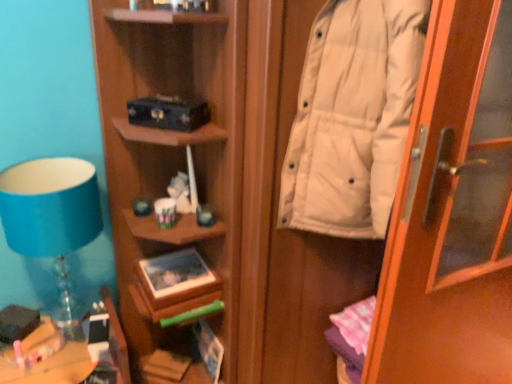
Measure the distance between wooden desk at lower left and camera.

wooden desk at lower left is 1.27 meters from camera.

What is the approximate height of matte green book at center, the 2th book from the top?

The height of matte green book at center, the 2th book from the top, is 4.74 inches.

What do you see at coordinates (209, 348) in the screenshot? I see `matte blue book at lower center, marked as the second book in a bottom-to-top arrangement` at bounding box center [209, 348].

Describe the element at coordinates (168, 113) in the screenshot. Image resolution: width=512 pixels, height=384 pixels. I see `matte black book at upper center, which is counted as the fourth book, starting from the bottom` at that location.

Locate an element on the screen. The image size is (512, 384). white matte door at right is located at coordinates (452, 212).

Locate an element on the screen. The width and height of the screenshot is (512, 384). wooden desk at lower left is located at coordinates (51, 367).

Does wooden desk at lower left have a lesser width compared to white matte door at right?

Incorrect, the width of wooden desk at lower left is not less than that of white matte door at right.

In the image, is wooden desk at lower left on the left side or the right side of white matte door at right?

wooden desk at lower left is to the left of white matte door at right.

Is wooden desk at lower left inside or outside of white matte door at right?

wooden desk at lower left is outside white matte door at right.

Does wooden desk at lower left have a greater width compared to matte green book at center, the 3th book in the bottom-to-top sequence?

Yes, wooden desk at lower left is wider than matte green book at center, the 3th book in the bottom-to-top sequence.

Is wooden desk at lower left far away from matte green book at center, the 2th book from the top?

No, there isn't a large distance between wooden desk at lower left and matte green book at center, the 2th book from the top.

From the image's perspective, which book is the 2nd one above the wooden desk at lower left? Please provide its 2D coordinates.

[(176, 273)]

How many degrees apart are the facing directions of wooden desk at lower left and matte green book at center, the 2th book from the top?

0.0574 degrees.

From a real-world perspective, is white matte coat at right on matte black book at upper center, which is counted as the fourth book, starting from the bottom?

Correct, in the physical world, white matte coat at right is higher than matte black book at upper center, which is counted as the fourth book, starting from the bottom.

Who is taller, white matte coat at right or matte black book at upper center, the 1th book in the top-to-bottom sequence?

white matte coat at right.

In terms of size, does white matte coat at right appear bigger or smaller than matte black book at upper center, the 1th book in the top-to-bottom sequence?

Considering their sizes, white matte coat at right takes up more space than matte black book at upper center, the 1th book in the top-to-bottom sequence.

Can matte green book at center, the 2th book from the top, be found inside matte blue book at lower center, the 3th book from the top?

No, matte green book at center, the 2th book from the top, is not a part of matte blue book at lower center, the 3th book from the top.

Would you say matte blue book at lower center, the 3th book from the top, is to the left or to the right of matte green book at center, the 2th book from the top, in the picture?

From the image, it's evident that matte blue book at lower center, the 3th book from the top, is to the right of matte green book at center, the 2th book from the top.

Is matte blue book at lower center, marked as the second book in a bottom-to-top arrangement, taller than matte green book at center, the 3th book in the bottom-to-top sequence?

Indeed, matte blue book at lower center, marked as the second book in a bottom-to-top arrangement, has a greater height compared to matte green book at center, the 3th book in the bottom-to-top sequence.

Is matte blue glass at left oriented away from matte blue book at lower center, the 3th book from the top?

matte blue glass at left does not have its back to matte blue book at lower center, the 3th book from the top.

Considering the relative positions of matte blue glass at left and matte blue book at lower center, the 3th book from the top, in the image provided, is matte blue glass at left in front of matte blue book at lower center, the 3th book from the top,?

Yes.

How distant is matte blue glass at left from matte blue book at lower center, the 3th book from the top?

matte blue glass at left is 69.18 centimeters away from matte blue book at lower center, the 3th book from the top.

Locate an element on the screen. This screenshot has height=384, width=512. table lamp above the matte blue book at lower center, marked as the second book in a bottom-to-top arrangement (from a real-world perspective) is located at coordinates (51, 212).

Considering the positions of objects matte green book at center, the 3th book in the bottom-to-top sequence, and matte blue book at lower center, marked as the second book in a bottom-to-top arrangement, in the image provided, who is more to the left, matte green book at center, the 3th book in the bottom-to-top sequence, or matte blue book at lower center, marked as the second book in a bottom-to-top arrangement,?

matte green book at center, the 3th book in the bottom-to-top sequence.

Do you think matte green book at center, the 3th book in the bottom-to-top sequence, is within matte blue book at lower center, marked as the second book in a bottom-to-top arrangement, or outside of it?

matte green book at center, the 3th book in the bottom-to-top sequence, is located beyond the bounds of matte blue book at lower center, marked as the second book in a bottom-to-top arrangement.

Is point (175, 255) closer to viewer compared to point (209, 343)?

Yes.

Can you confirm if matte green book at center, the 2th book from the top, is shorter than matte blue book at lower center, the 3th book from the top?

Yes, matte green book at center, the 2th book from the top, is shorter than matte blue book at lower center, the 3th book from the top.

Which of these two, matte blue book at lower center, marked as the second book in a bottom-to-top arrangement, or hardcover book at lower center, acting as the 4th book starting from the top, is thinner?

matte blue book at lower center, marked as the second book in a bottom-to-top arrangement.

Is matte blue book at lower center, the 3th book from the top, facing towards hardcover book at lower center, the first book positioned from the bottom?

Yes, matte blue book at lower center, the 3th book from the top, is facing hardcover book at lower center, the first book positioned from the bottom.

Is matte blue book at lower center, marked as the second book in a bottom-to-top arrangement, positioned in front of hardcover book at lower center, the first book positioned from the bottom?

Yes, the depth of matte blue book at lower center, marked as the second book in a bottom-to-top arrangement, is less than that of hardcover book at lower center, the first book positioned from the bottom.

Find the location of `door on the right of wooden desk at lower left`. door on the right of wooden desk at lower left is located at coordinates (452, 212).

In the image, there is a matte green book at center, the 2th book from the top. Identify the location of furniture below it (from the image's perspective). This screenshot has height=384, width=512. (51, 367).

Estimate the real-world distances between objects in this image. Which object is further from matte green book at center, the 2th book from the top, white matte coat at right or matte black book at upper center, which is counted as the fourth book, starting from the bottom?

white matte coat at right is positioned further to the anchor matte green book at center, the 2th book from the top.

Based on their spatial positions, is white matte door at right or matte blue book at lower center, marked as the second book in a bottom-to-top arrangement, closer to hardcover book at lower center, acting as the 4th book starting from the top?

matte blue book at lower center, marked as the second book in a bottom-to-top arrangement, is closer to hardcover book at lower center, acting as the 4th book starting from the top.

From the image, which object appears to be nearer to matte blue book at lower center, the 3th book from the top, white matte coat at right or hardcover book at lower center, the first book positioned from the bottom?

hardcover book at lower center, the first book positioned from the bottom, is closer to matte blue book at lower center, the 3th book from the top.

From the image, which object appears to be nearer to wooden desk at lower left, matte black book at upper center, the 1th book in the top-to-bottom sequence, or white matte door at right?

matte black book at upper center, the 1th book in the top-to-bottom sequence, is closer to wooden desk at lower left.

From the image, which object appears to be nearer to hardcover book at lower center, the first book positioned from the bottom, white matte coat at right or matte black book at upper center, which is counted as the fourth book, starting from the bottom?

matte black book at upper center, which is counted as the fourth book, starting from the bottom, is positioned closer to the anchor hardcover book at lower center, the first book positioned from the bottom.

Based on their spatial positions, is hardcover book at lower center, acting as the 4th book starting from the top, or white matte coat at right closer to matte black book at upper center, the 1th book in the top-to-bottom sequence?

Among the two, white matte coat at right is located nearer to matte black book at upper center, the 1th book in the top-to-bottom sequence.

Based on their spatial positions, is white matte door at right or matte black book at upper center, which is counted as the fourth book, starting from the bottom, further from hardcover book at lower center, the first book positioned from the bottom?

The object further to hardcover book at lower center, the first book positioned from the bottom, is white matte door at right.

Which object lies nearer to the anchor point wooden desk at lower left, matte green book at center, the 3th book in the bottom-to-top sequence, or matte black book at upper center, the 1th book in the top-to-bottom sequence?

matte green book at center, the 3th book in the bottom-to-top sequence, is positioned closer to the anchor wooden desk at lower left.

Locate an element on the screen. coat located between matte green book at center, the 3th book in the bottom-to-top sequence, and white matte door at right in the left-right direction is located at coordinates (352, 117).

This screenshot has width=512, height=384. Find the location of `coat between wooden desk at lower left and white matte door at right from left to right`. coat between wooden desk at lower left and white matte door at right from left to right is located at coordinates (352, 117).

At what (x,y) coordinates should I click in order to perform the action: click on table lamp located between wooden desk at lower left and white matte coat at right in the left-right direction. Please return your answer as a coordinate pair (x, y). Looking at the image, I should click on (51, 212).

I want to click on furniture between matte blue glass at left and hardcover book at lower center, acting as the 4th book starting from the top, along the z-axis, so click(51, 367).